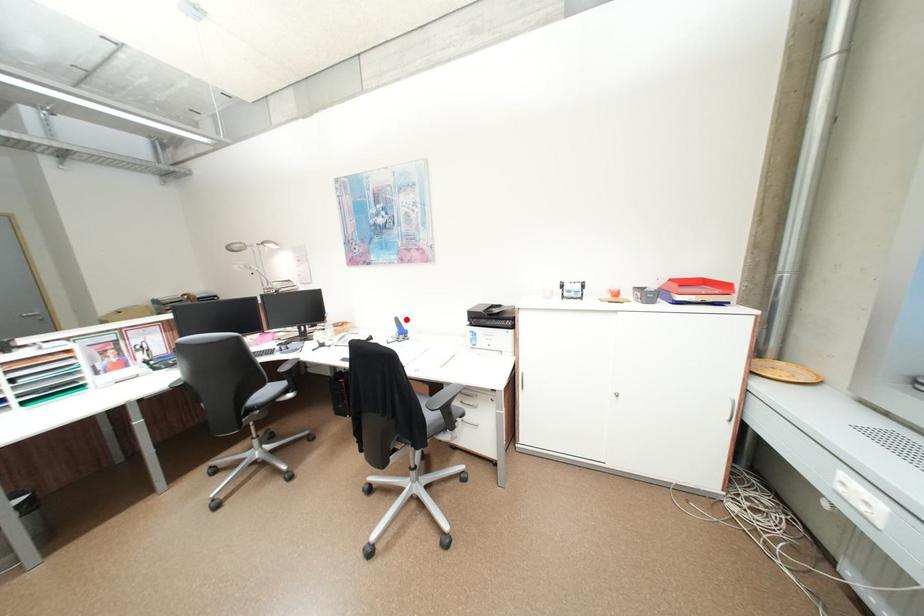
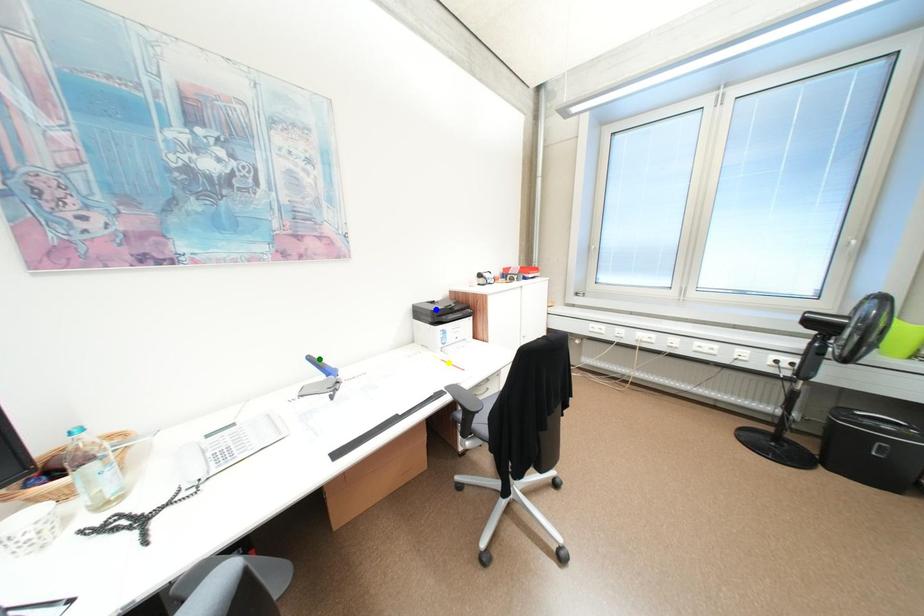
Question: I am providing you with two images of the same scene from different viewpoints. A red point is marked on the first image. You are given multiple points on the second image. Which mark in image 2 goes with the point in image 1?

Choices:
 (A) green point
 (B) blue point
 (C) yellow point

Answer: (A)